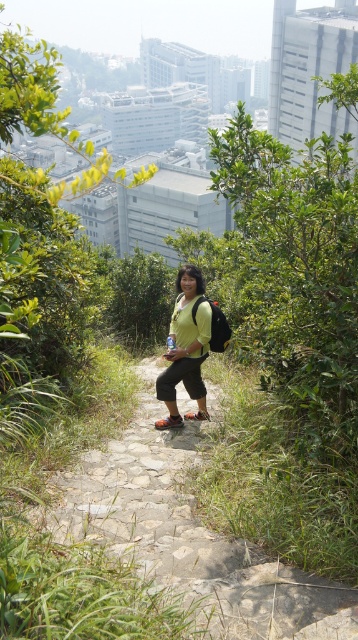
You are a hiker trying to navigate through the dense vegetation. You see the stone path at center and the matte green shirt at center. Which object is larger in the image?

The matte green shirt at center is larger than the stone path at center.